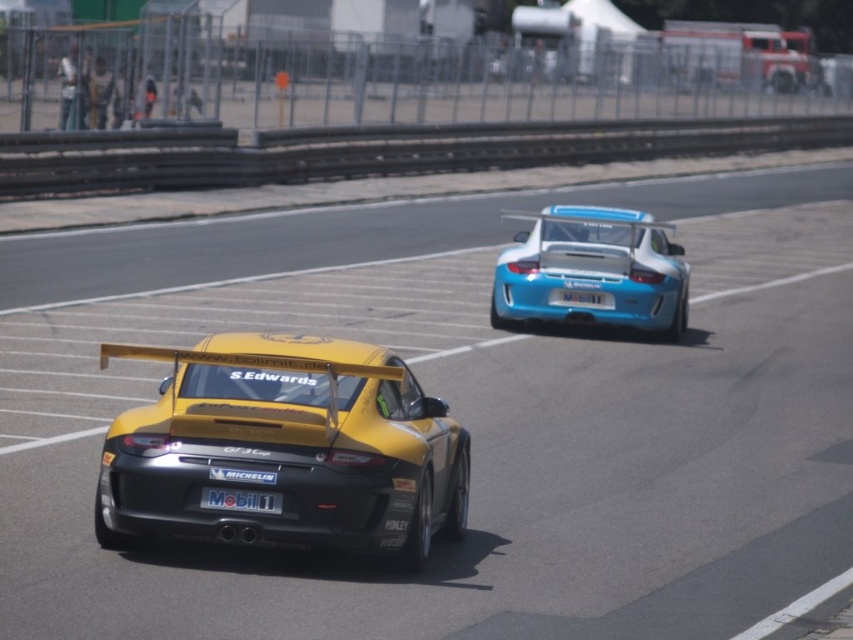
Who is higher up, shiny blue car at upper right or white glossy license plate at rear?

Positioned higher is shiny blue car at upper right.

Between shiny blue car at upper right and white glossy license plate at rear, which one appears on the left side from the viewer's perspective?

white glossy license plate at rear is more to the left.

Which is in front, point (549, 250) or point (245, 499)?

Point (245, 499)

Find the location of a particular element. This screenshot has height=640, width=853. shiny blue car at upper right is located at coordinates (593, 269).

The height and width of the screenshot is (640, 853). Describe the element at coordinates (285, 449) in the screenshot. I see `yellow matte/satin sports car at center` at that location.

Who is more distant from viewer, (189, 513) or (515, 282)?

Point (515, 282)

Where is `yellow matte/satin sports car at center`? yellow matte/satin sports car at center is located at coordinates (285, 449).

Between point (389, 480) and point (578, 296), which one is positioned behind?

Positioned behind is point (578, 296).

What do you see at coordinates (285, 449) in the screenshot?
I see `yellow matte/satin sports car at center` at bounding box center [285, 449].

I want to click on yellow matte/satin sports car at center, so click(285, 449).